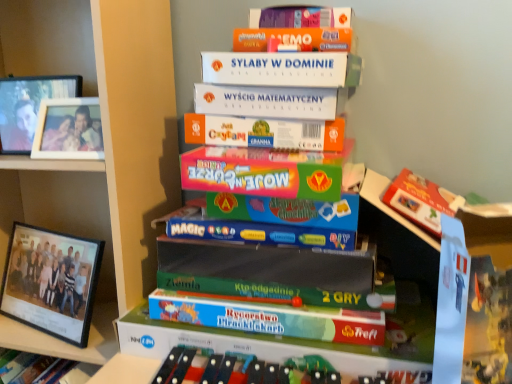
Question: Is white cardboard boxes at center facing towards green matte board game at center, acting as the 2th book starting from the bottom?

Choices:
 (A) yes
 (B) no

Answer: (B)

Question: Is the position of white cardboard boxes at center less distant than that of green matte board game at center, arranged as the 1th book when viewed from the top?

Choices:
 (A) no
 (B) yes

Answer: (B)

Question: Considering the relative positions of white cardboard boxes at center and green matte board game at center, arranged as the 1th book when viewed from the top, in the image provided, is white cardboard boxes at center to the right of green matte board game at center, arranged as the 1th book when viewed from the top, from the viewer's perspective?

Choices:
 (A) no
 (B) yes

Answer: (A)

Question: From a real-world perspective, is white cardboard boxes at center under green matte board game at center, acting as the 2th book starting from the bottom?

Choices:
 (A) no
 (B) yes

Answer: (B)

Question: Is white cardboard boxes at center at the left side of green matte board game at center, acting as the 2th book starting from the bottom?

Choices:
 (A) yes
 (B) no

Answer: (A)

Question: Can we say white cardboard boxes at center lies outside green matte board game at center, arranged as the 1th book when viewed from the top?

Choices:
 (A) yes
 (B) no

Answer: (A)

Question: From the image's perspective, would you say white cardboard boxes at center is positioned over matte plastic game at center, which is the 2th book from top to bottom?

Choices:
 (A) yes
 (B) no

Answer: (A)

Question: Is white cardboard boxes at center positioned with its back to matte plastic game at center, which is the 2th book from top to bottom?

Choices:
 (A) no
 (B) yes

Answer: (A)

Question: Can you confirm if white cardboard boxes at center is wider than matte plastic game at center, the 1th book positioned from the bottom?

Choices:
 (A) no
 (B) yes

Answer: (B)

Question: Is there a large distance between white cardboard boxes at center and matte plastic game at center, the 1th book positioned from the bottom?

Choices:
 (A) no
 (B) yes

Answer: (A)

Question: Considering the relative sizes of white cardboard boxes at center and matte plastic game at center, which is the 2th book from top to bottom, in the image provided, is white cardboard boxes at center smaller than matte plastic game at center, which is the 2th book from top to bottom,?

Choices:
 (A) no
 (B) yes

Answer: (A)

Question: Considering the relative sizes of white cardboard boxes at center and matte plastic game at center, the 1th book positioned from the bottom, in the image provided, is white cardboard boxes at center taller than matte plastic game at center, the 1th book positioned from the bottom,?

Choices:
 (A) no
 (B) yes

Answer: (B)

Question: Is black plastic picture frame at left, which ranks as the 3th picture frame in top-to-bottom order, wider than green matte board game at center, acting as the 2th book starting from the bottom?

Choices:
 (A) yes
 (B) no

Answer: (B)